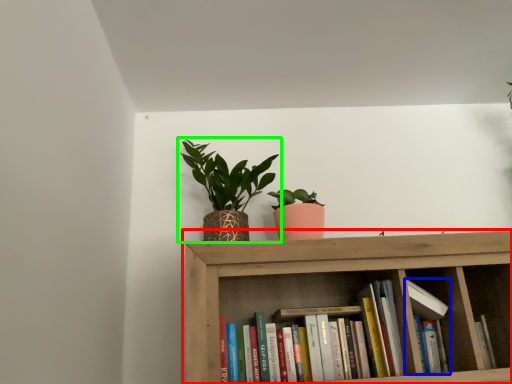
Question: Considering the real-world distances, which object is farthest from shelf (highlighted by a red box)? book (highlighted by a blue box) or houseplant (highlighted by a green box)?

Choices:
 (A) book
 (B) houseplant

Answer: (B)